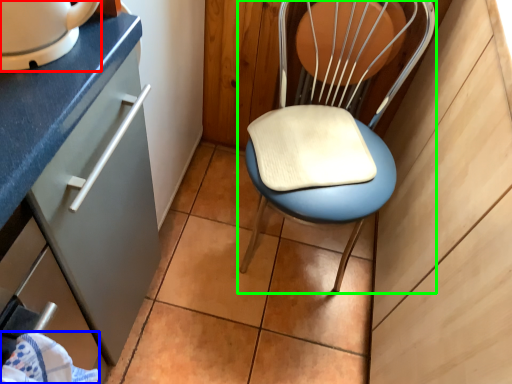
Question: Which object is the closest to the home appliance (highlighted by a red box)? Choose among these: material (highlighted by a blue box) or chair (highlighted by a green box).

Choices:
 (A) material
 (B) chair

Answer: (A)